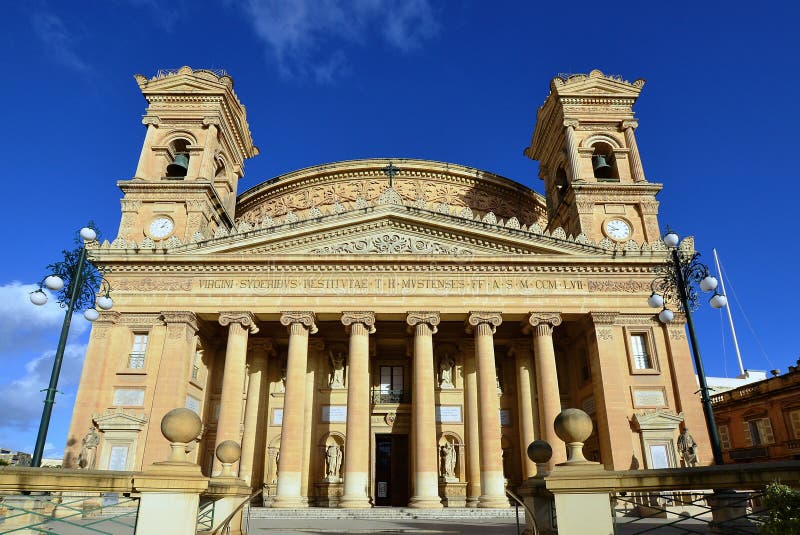
Locate an element on the screen. Image resolution: width=800 pixels, height=535 pixels. white globe light is located at coordinates (657, 302), (662, 317), (716, 302), (712, 282), (676, 243), (52, 284), (40, 292), (77, 233), (113, 300), (94, 312).